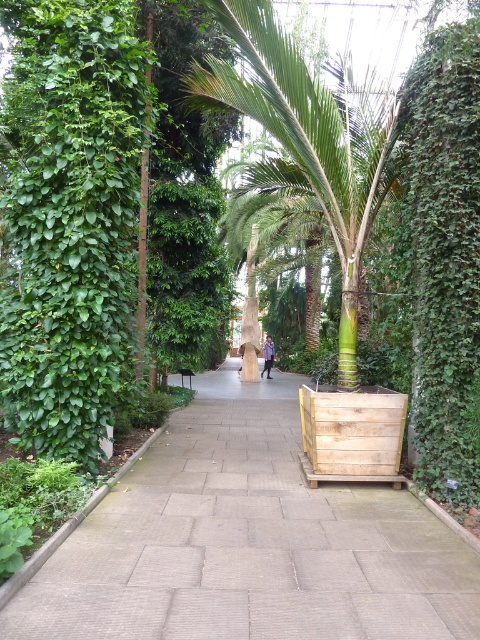
This screenshot has height=640, width=480. What are the coordinates of `brown stone pavement at center` in the screenshot? It's located at (249, 541).

Can you confirm if brown stone pavement at center is smaller than light blue denim jacket at center?

No, brown stone pavement at center is not smaller than light blue denim jacket at center.

Is point (117, 564) closer to camera compared to point (264, 369)?

Yes, it is.

This screenshot has width=480, height=640. Find the location of `brown stone pavement at center`. brown stone pavement at center is located at coordinates (249, 541).

From the picture: Does brown stone pavement at center appear on the right side of green leafy hedge at right?

Incorrect, brown stone pavement at center is not on the right side of green leafy hedge at right.

Which is in front, point (141, 602) or point (428, 369)?

Positioned in front is point (141, 602).

Where is `brown stone pavement at center`? This screenshot has height=640, width=480. brown stone pavement at center is located at coordinates (249, 541).

In order to click on green textured palm tree at center in this screenshot , I will do `click(309, 138)`.

Is point (254, 109) closer to camera compared to point (271, 353)?

Yes, point (254, 109) is in front of point (271, 353).

This screenshot has width=480, height=640. Find the location of `green textured palm tree at center`. green textured palm tree at center is located at coordinates (309, 138).